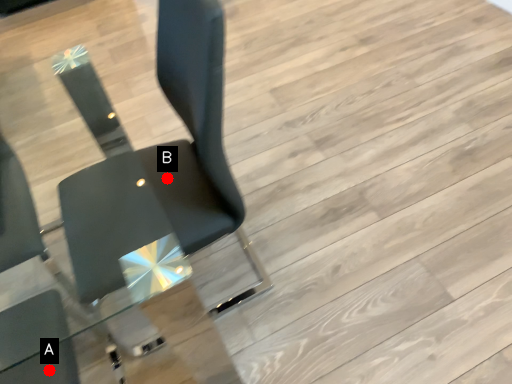
Question: Two points are circled on the image, labeled by A and B beside each circle. Which point is farther from the camera taking this photo?

Choices:
 (A) A is further
 (B) B is further

Answer: (B)